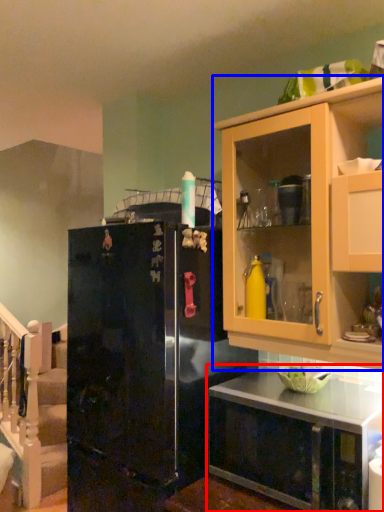
Question: Among these objects, which one is nearest to the camera, countertop (highlighted by a red box) or cabinetry (highlighted by a blue box)?

Choices:
 (A) countertop
 (B) cabinetry

Answer: (A)